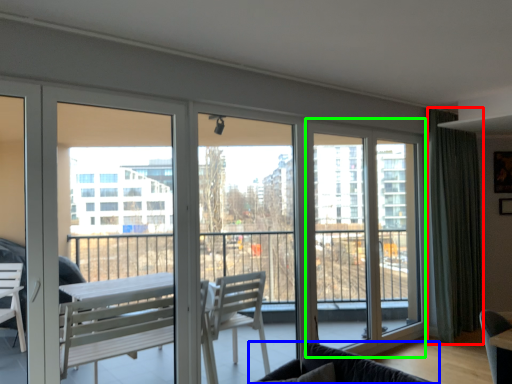
Question: Based on their relative distances, which object is farther from curtain (highlighted by a red box)? Choose from studio couch (highlighted by a blue box) and screen door (highlighted by a green box).

Choices:
 (A) studio couch
 (B) screen door

Answer: (A)